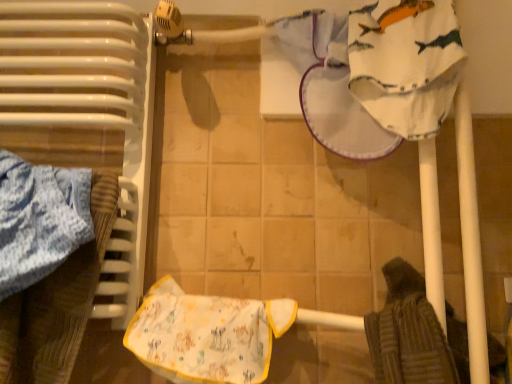
This screenshot has width=512, height=384. Find the location of `printed fabric bib at center`. printed fabric bib at center is located at coordinates (206, 335).

Describe the element at coordinates (206, 335) in the screenshot. I see `printed fabric bib at center` at that location.

Identify the location of white glossy radiator at left. This screenshot has width=512, height=384. (88, 112).

Describe the element at coordinates (88, 112) in the screenshot. I see `white glossy radiator at left` at that location.

Identify the location of printed fabric bib at center. (206, 335).

Is white glossy radiator at left to the left of printed fabric bib at center from the viewer's perspective?

Correct, you'll find white glossy radiator at left to the left of printed fabric bib at center.

Which is in front, white glossy radiator at left or printed fabric bib at center?

white glossy radiator at left is more forward.

Which point is more forward, (x=138, y=177) or (x=183, y=310)?

The point (x=183, y=310) is more forward.

From the image's perspective, between white glossy radiator at left and printed fabric bib at center, who is located below?

From the image's view, printed fabric bib at center is below.

From a real-world perspective, who is located lower, white glossy radiator at left or printed fabric bib at center?

printed fabric bib at center, from a real-world perspective.

Considering the relative sizes of white glossy radiator at left and printed fabric bib at center in the image provided, is white glossy radiator at left wider than printed fabric bib at center?

Yes.

Between white glossy radiator at left and printed fabric bib at center, which one has less height?

printed fabric bib at center is shorter.

Considering the sizes of white glossy radiator at left and printed fabric bib at center in the image, is white glossy radiator at left bigger or smaller than printed fabric bib at center?

white glossy radiator at left is bigger than printed fabric bib at center.

Which is correct: white glossy radiator at left is inside printed fabric bib at center, or outside of it?

Result: white glossy radiator at left cannot be found inside printed fabric bib at center.

Is white glossy radiator at left far away from printed fabric bib at center?

That's not correct — white glossy radiator at left is a little close to printed fabric bib at center.

Is white glossy radiator at left facing away from printed fabric bib at center?

That's not correct — white glossy radiator at left is not looking away from printed fabric bib at center.

How many degrees apart are the facing directions of white glossy radiator at left and printed fabric bib at center?

The facing directions of white glossy radiator at left and printed fabric bib at center are 0.000994 degrees apart.

How far apart are white glossy radiator at left and printed fabric bib at center?

white glossy radiator at left and printed fabric bib at center are 10.59 inches apart from each other.

At what (x,y) coordinates should I click in order to perform the action: click on radiator in front of the printed fabric bib at center. Please return your answer as a coordinate pair (x, y). Looking at the image, I should click on (88, 112).

Is printed fabric bib at center to the left of white glossy radiator at left from the viewer's perspective?

Incorrect, printed fabric bib at center is not on the left side of white glossy radiator at left.

Considering the positions of objects printed fabric bib at center and white glossy radiator at left in the image provided, who is in front, printed fabric bib at center or white glossy radiator at left?

white glossy radiator at left is closer to the camera.

Is point (250, 312) positioned after point (76, 38)?

No.

From the image's perspective, which is below, printed fabric bib at center or white glossy radiator at left?

printed fabric bib at center is shown below in the image.

From a real-world perspective, is printed fabric bib at center beneath white glossy radiator at left?

Yes, from a real-world perspective, printed fabric bib at center is below white glossy radiator at left.

Can you confirm if printed fabric bib at center is thinner than white glossy radiator at left?

Indeed, printed fabric bib at center has a lesser width compared to white glossy radiator at left.

From the picture: Considering the relative sizes of printed fabric bib at center and white glossy radiator at left in the image provided, is printed fabric bib at center taller than white glossy radiator at left?

In fact, printed fabric bib at center may be shorter than white glossy radiator at left.

Consider the image. Does printed fabric bib at center have a larger size compared to white glossy radiator at left?

Incorrect, printed fabric bib at center is not larger than white glossy radiator at left.

Is printed fabric bib at center spatially inside white glossy radiator at left, or outside of it?

printed fabric bib at center is not inside white glossy radiator at left, it's outside.

Is printed fabric bib at center far away from white glossy radiator at left?

printed fabric bib at center is near white glossy radiator at left, not far away.

Could you tell me if printed fabric bib at center is turned towards white glossy radiator at left?

No, printed fabric bib at center is not aimed at white glossy radiator at left.

How different are the orientations of printed fabric bib at center and white glossy radiator at left in degrees?

printed fabric bib at center and white glossy radiator at left are facing 0.000994 degrees away from each other.

Where is `radiator above the printed fabric bib at center (from a real-world perspective)`? The height and width of the screenshot is (384, 512). radiator above the printed fabric bib at center (from a real-world perspective) is located at coordinates [x=88, y=112].

Find the location of `material below the white glossy radiator at left (from a real-world perspective)`. material below the white glossy radiator at left (from a real-world perspective) is located at coordinates (206, 335).

Find the location of a particular element. Image resolution: width=512 pixels, height=384 pixels. material behind the white glossy radiator at left is located at coordinates (206, 335).